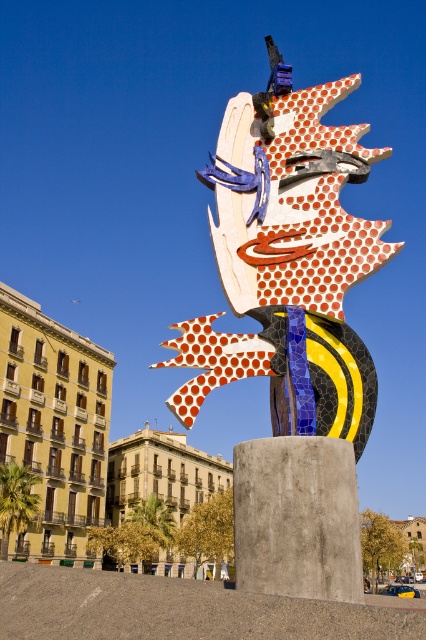
Which is more to the left, polka dot mosaic face at center or polychrome mosaic sculpture at center?

From the viewer's perspective, polka dot mosaic face at center appears more on the left side.

Is polka dot mosaic face at center taller than polychrome mosaic sculpture at center?

Incorrect, polka dot mosaic face at center's height is not larger of polychrome mosaic sculpture at center's.

Between point (264, 307) and point (203, 632), which one is positioned in front?

Point (203, 632) is in front.

You are a GUI agent. You are given a task and a screenshot of the screen. Output one action in this format:
    pyautogui.click(x=<x>, y=<y>)
    Task: Click on the polka dot mosaic face at center
    
    Given the screenshot: What is the action you would take?
    pyautogui.click(x=290, y=332)